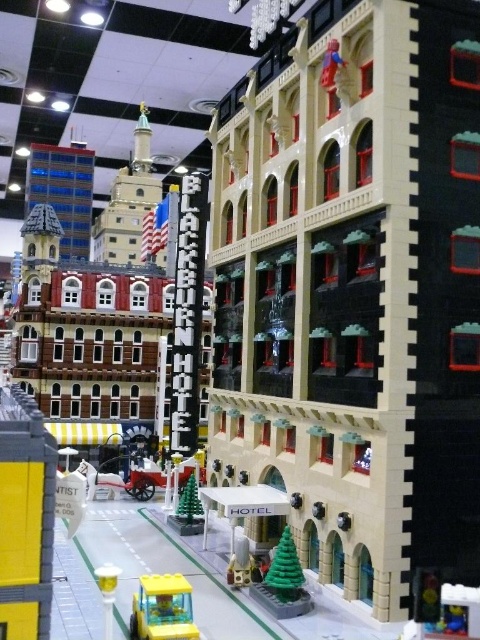
Question: Which object is the farthest from the green matte christmas tree at center?

Choices:
 (A) matte gray statue at center
 (B) translucent yellow plastic car at lower left

Answer: (B)

Question: Does translucent yellow plastic car at lower left appear under green plastic christmas tree at lower center?

Choices:
 (A) no
 (B) yes

Answer: (A)

Question: Considering the real-world distances, which object is farthest from the green plastic christmas tree at lower center?

Choices:
 (A) green matte christmas tree at center
 (B) translucent yellow plastic car at lower left

Answer: (A)

Question: From the image, what is the correct spatial relationship of translucent yellow plastic car at lower left in relation to green matte christmas tree at center?

Choices:
 (A) above
 (B) below

Answer: (A)

Question: Which is nearer to the translucent yellow plastic car at lower left?

Choices:
 (A) green matte christmas tree at center
 (B) green plastic christmas tree at lower center

Answer: (B)

Question: Is the position of translucent yellow plastic car at lower left more distant than that of matte gray statue at center?

Choices:
 (A) yes
 (B) no

Answer: (B)